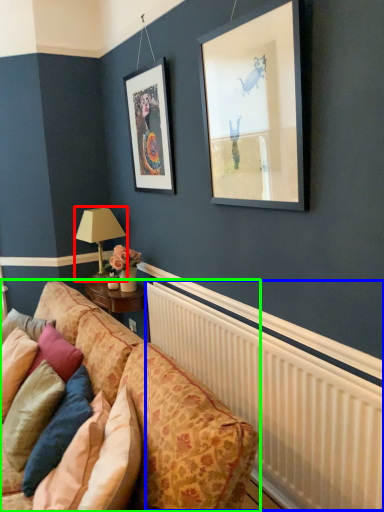
Question: Estimate the real-world distances between objects in this image. Which object is farther from table lamp (highlighted by a red box), radiator (highlighted by a blue box) or studio couch (highlighted by a green box)?

Choices:
 (A) radiator
 (B) studio couch

Answer: (A)